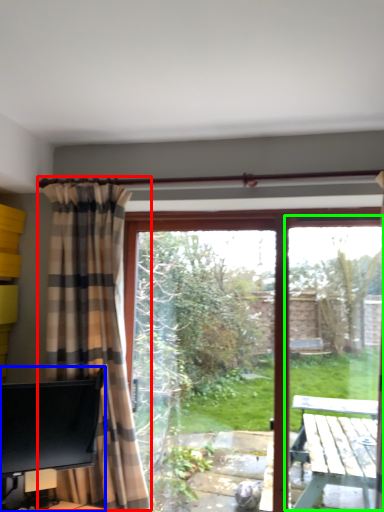
Question: Estimate the real-world distances between objects in this image. Which object is farther from curtain (highlighted by a red box), desk (highlighted by a blue box) or screen door (highlighted by a green box)?

Choices:
 (A) desk
 (B) screen door

Answer: (B)